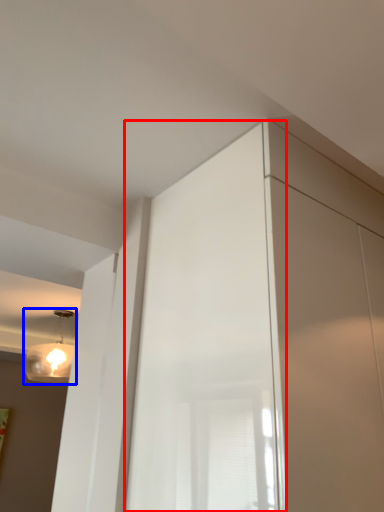
Question: Among these objects, which one is nearest to the camera, screen door (highlighted by a red box) or lamp (highlighted by a blue box)?

Choices:
 (A) screen door
 (B) lamp

Answer: (A)